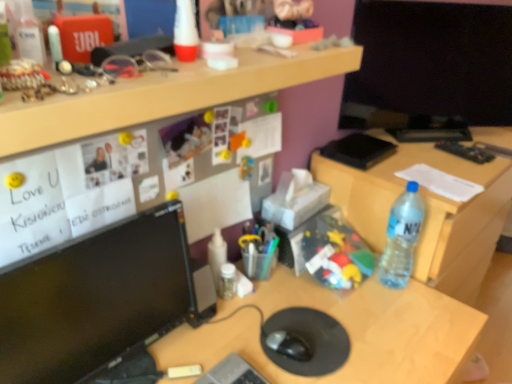
This screenshot has width=512, height=384. What are the coordinates of `empty space that is to the right of black matte mouse at center` in the screenshot? It's located at (350, 343).